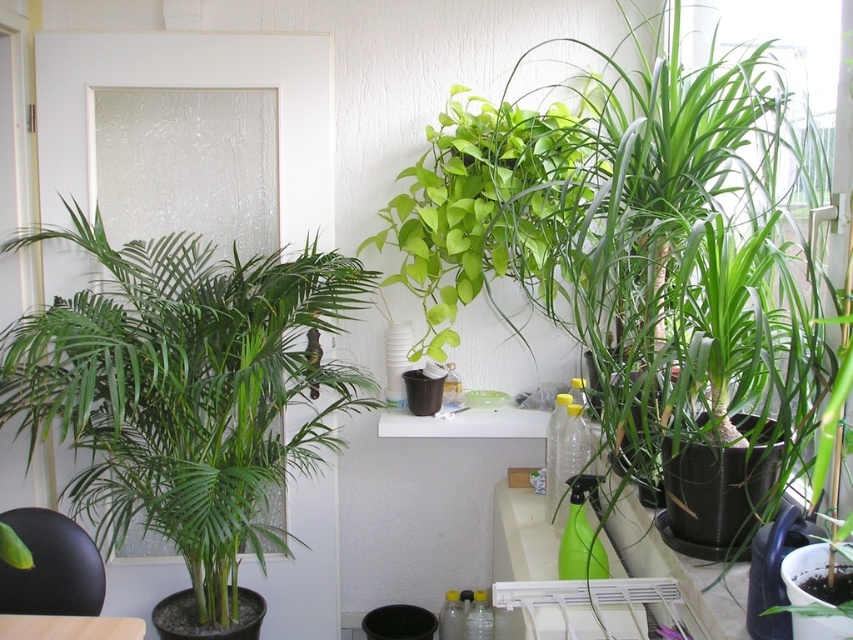
Question: Estimate the real-world distances between objects in this image. Which object is closer to the wooden table at lower left?

Choices:
 (A) green glossy pothos at center
 (B) green leafy plant at left

Answer: (B)

Question: Based on their relative distances, which object is nearer to the wooden table at lower left?

Choices:
 (A) green glossy pothos at center
 (B) green leafy plant at left

Answer: (B)

Question: Is green leafy plant at left bigger than green glossy pothos at center?

Choices:
 (A) yes
 (B) no

Answer: (A)

Question: Is green leafy plant at left further to the viewer compared to wooden table at lower left?

Choices:
 (A) no
 (B) yes

Answer: (B)

Question: Which object is farther from the camera taking this photo?

Choices:
 (A) wooden table at lower left
 (B) green glossy pothos at center

Answer: (B)

Question: Is green leafy plant at left positioned behind wooden table at lower left?

Choices:
 (A) yes
 (B) no

Answer: (A)